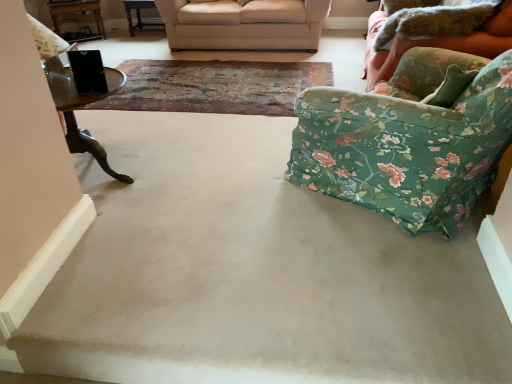
Identify the location of free space above beige carpet at center (from a real-world perspective). (276, 283).